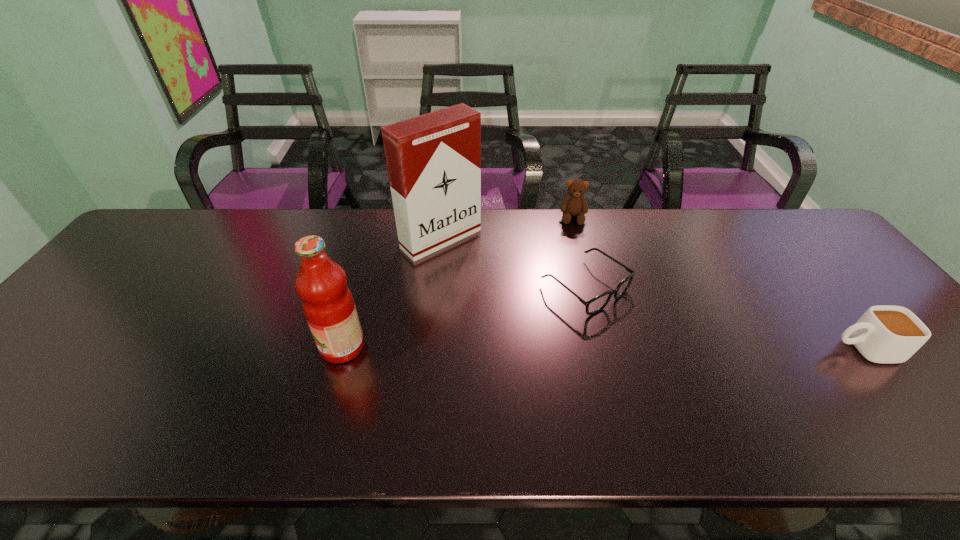
Locate an element on the screen. free space on the desktop that is between the fruit juice and the fourth tallest object and is positioned on the front-facing side of the cigarette_case is located at coordinates (567, 348).

At what (x,y) coordinates should I click in order to perform the action: click on vacant spot on the desktop that is between the fruit juice and the fourth tallest object and is positioned on the front-facing side of the spectacles. Please return your answer as a coordinate pair (x, y). The image size is (960, 540). Looking at the image, I should click on (670, 348).

You are a GUI agent. You are given a task and a screenshot of the screen. Output one action in this format:
    pyautogui.click(x=<x>, y=<y>)
    Task: Click on the vacant space on the desktop that is between the fruit juice and the fourth tallest object and is positioned on the face of the teddy bear
    
    Given the screenshot: What is the action you would take?
    pyautogui.click(x=576, y=348)